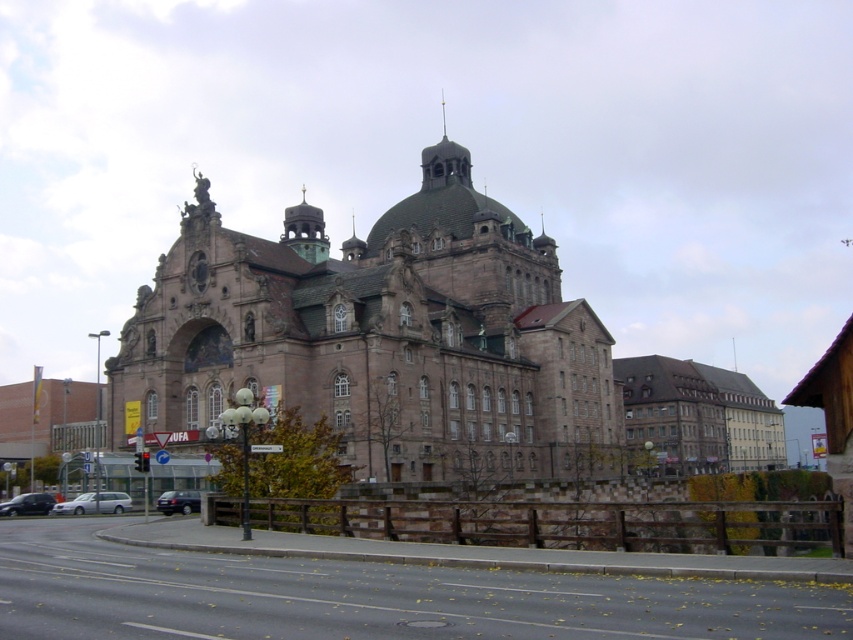
Is silver metallic car at lower left smaller than dark gray metallic car at lower left?

Yes, silver metallic car at lower left is smaller than dark gray metallic car at lower left.

Does silver metallic car at lower left appear on the right side of dark gray metallic car at lower left?

In fact, silver metallic car at lower left is to the left of dark gray metallic car at lower left.

The image size is (853, 640). In order to click on silver metallic car at lower left in this screenshot , I will do `click(94, 502)`.

I want to click on silver metallic car at lower left, so click(94, 502).

Can you confirm if brown stone church at center is bigger than silver metallic car at lower left?

Indeed, brown stone church at center has a larger size compared to silver metallic car at lower left.

How much distance is there between brown stone church at center and silver metallic car at lower left?

They are 38.27 meters apart.

Who is more forward, (393, 458) or (77, 513)?

Point (77, 513) is more forward.

Locate an element on the screen. This screenshot has width=853, height=640. brown stone church at center is located at coordinates (380, 337).

Who is more distant from viewer, (7, 504) or (170, 513)?

The point (7, 504) is more distant.

Find the location of a particular element. black glossy car at lower left is located at coordinates (27, 504).

Locate an element on the screen. The width and height of the screenshot is (853, 640). black glossy car at lower left is located at coordinates (27, 504).